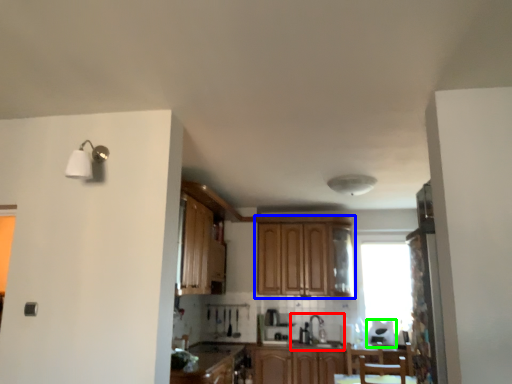
Question: Which object is positioned farthest from sink (highlighted by a red box)? Select from cabinetry (highlighted by a blue box) and appliance (highlighted by a green box).

Choices:
 (A) cabinetry
 (B) appliance

Answer: (A)